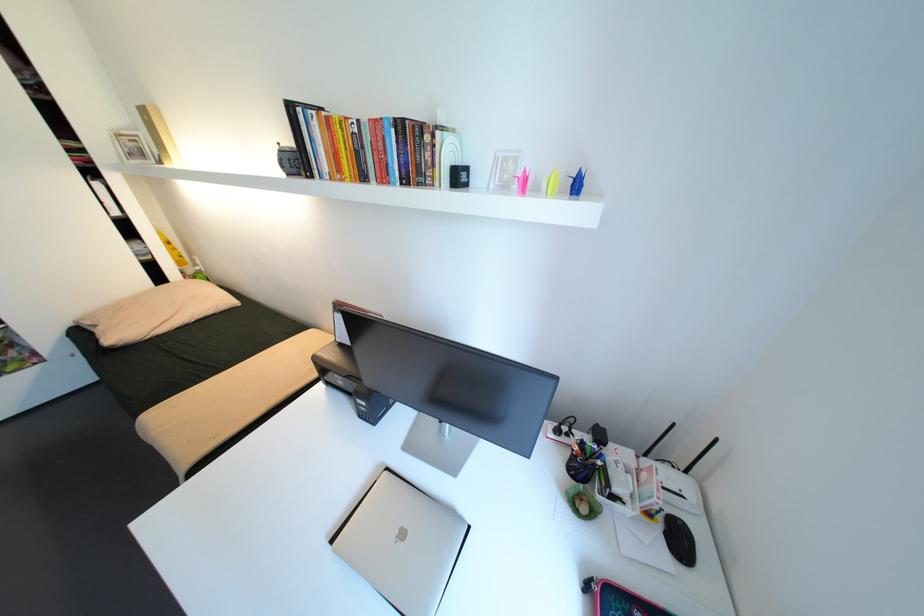
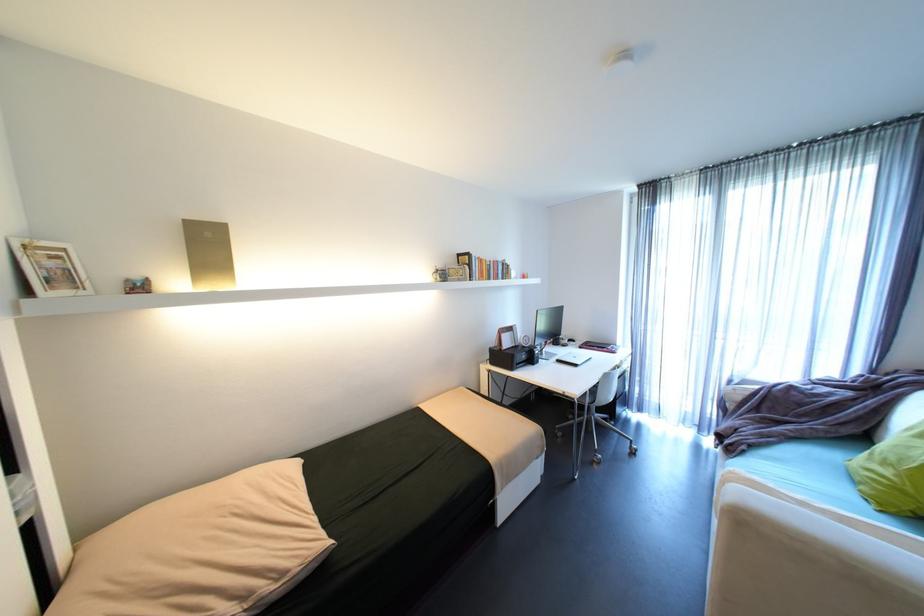
Find the pixel in the second image that matches pixel 112 337 in the first image.

(289, 575)